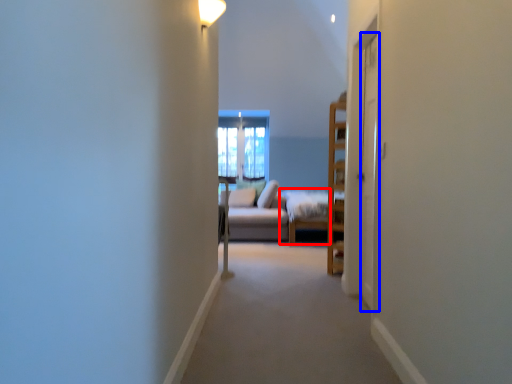
Question: Which of the following is the closest to the observer, bed frame (highlighted by a red box) or screen door (highlighted by a blue box)?

Choices:
 (A) bed frame
 (B) screen door

Answer: (B)